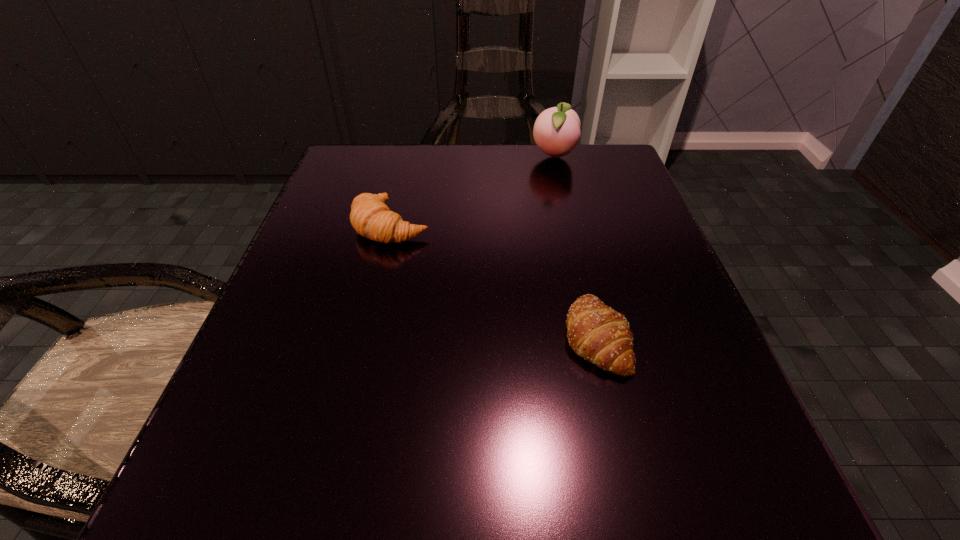
You are a GUI agent. You are given a task and a screenshot of the screen. Output one action in this format:
    pyautogui.click(x=<x>, y=<y>)
    Task: Click on the vacant space at the near right corner of the desktop
    The width and height of the screenshot is (960, 540).
    Given the screenshot: What is the action you would take?
    pyautogui.click(x=710, y=497)

What are the coordinates of `vacant point located between the nearest object and the peach` in the screenshot? It's located at (575, 247).

Locate an element on the screen. free space that is in between the farther crescent roll and the nearest object is located at coordinates (493, 281).

This screenshot has width=960, height=540. I want to click on free space between the left crescent roll and the nearest object, so click(493, 281).

I want to click on vacant area that lies between the nearest object and the peach, so click(575, 247).

I want to click on unoccupied position between the peach and the nearest object, so point(575,247).

Identify the location of free space between the right crescent roll and the tallest object. This screenshot has height=540, width=960. (575, 247).

What are the coordinates of `free space that is in between the leftmost object and the nearer crescent roll` in the screenshot? It's located at (493, 281).

Where is `unoccupied position between the nearer crescent roll and the farther crescent roll`? The height and width of the screenshot is (540, 960). unoccupied position between the nearer crescent roll and the farther crescent roll is located at coordinates (493, 281).

What are the coordinates of `vacant space that's between the right crescent roll and the tallest object` in the screenshot? It's located at (575, 247).